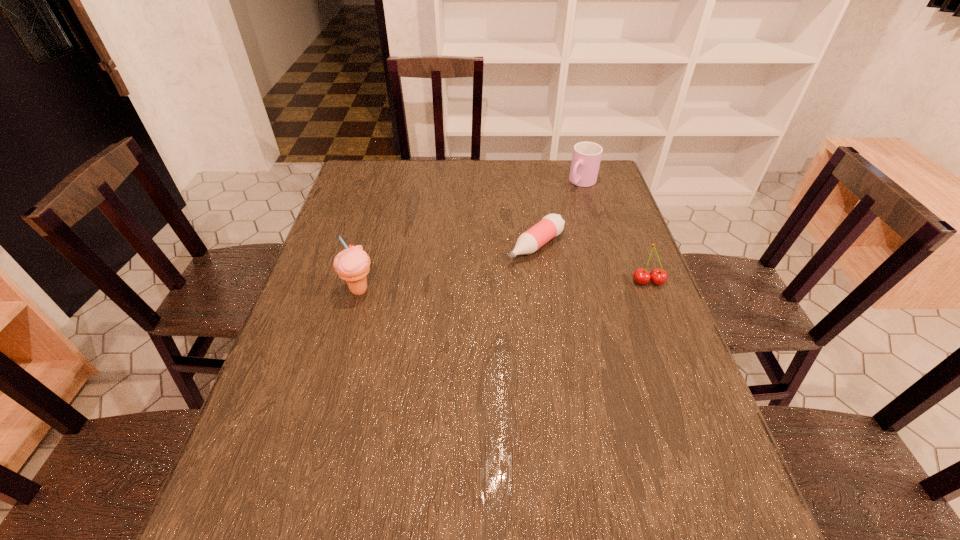
Where is `blank area at the far edge`? The image size is (960, 540). blank area at the far edge is located at coordinates (449, 173).

This screenshot has height=540, width=960. In the image, there is a desktop. Find the location of `free space at the near edge`. free space at the near edge is located at coordinates (443, 447).

Identify the location of vacant space at the left edge. The height and width of the screenshot is (540, 960). (342, 214).

At what (x,y) coordinates should I click in order to perform the action: click on vacant point at the right edge. Please return your answer as a coordinate pair (x, y). This screenshot has width=960, height=540. Looking at the image, I should click on (585, 207).

Locate an element on the screen. This screenshot has width=960, height=540. vacant space at the far right corner of the desktop is located at coordinates (601, 164).

At what (x,y) coordinates should I click in order to perform the action: click on vacant space at the near right corner of the desktop. Please return your answer as a coordinate pair (x, y). This screenshot has width=960, height=540. Looking at the image, I should click on (667, 449).

Locate an element on the screen. vacant area that lies between the rightmost object and the shortest object is located at coordinates (592, 264).

Locate an element on the screen. The width and height of the screenshot is (960, 540). free area in between the cherry and the icecream is located at coordinates (504, 286).

Identify the location of free spot between the tallest object and the shortest object. This screenshot has height=540, width=960. (447, 268).

Where is `free spot between the third nearest object and the cherry`? The image size is (960, 540). free spot between the third nearest object and the cherry is located at coordinates (592, 264).